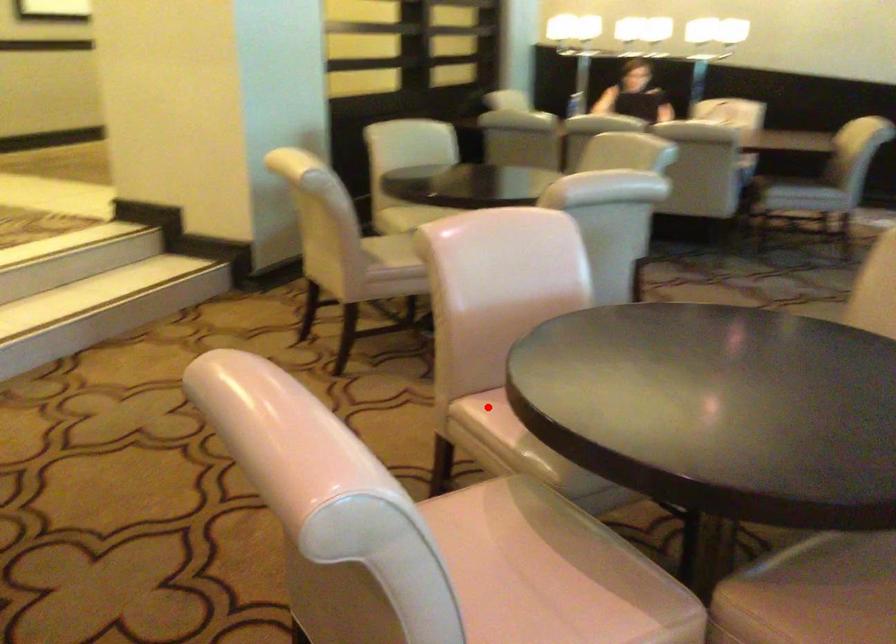
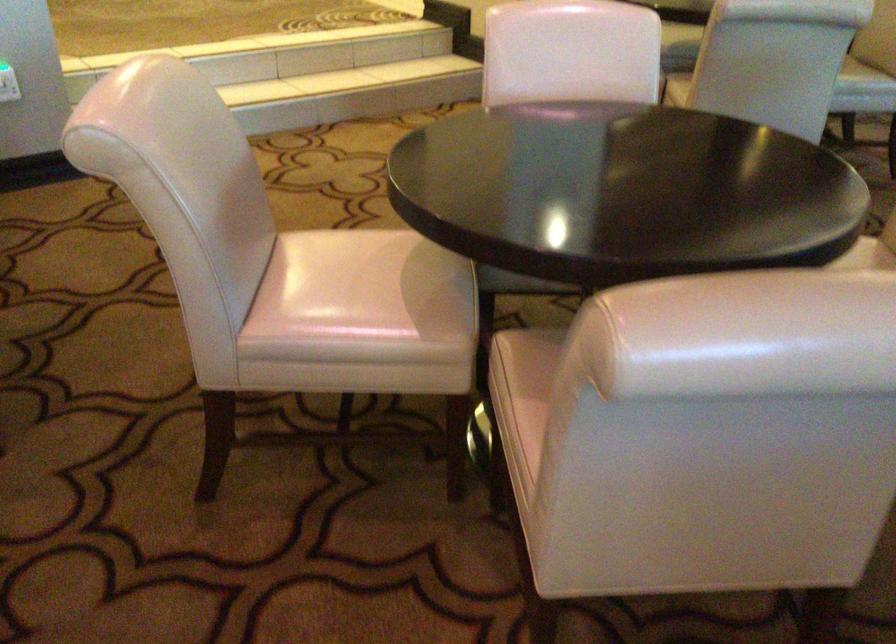
Question: I am providing you with two images of the same scene from different viewpoints. A red point is marked on the first image. At the location where the point appears in image 1, is it still visible in image 2?

Choices:
 (A) Yes
 (B) No

Answer: (B)